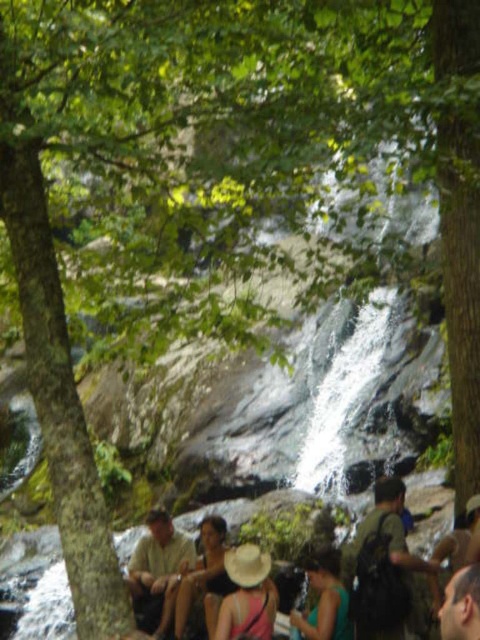
Question: Estimate the real-world distances between objects in this image. Which object is closer to the green fabric backpack at center?

Choices:
 (A) white frothy water at center
 (B) beige straw hat at center

Answer: (B)

Question: Estimate the real-world distances between objects in this image. Which object is farther from the green fabric backpack at center?

Choices:
 (A) light brown fabric shirt at lower left
 (B) white frothy water at center

Answer: (B)

Question: Which object is farther from the camera taking this photo?

Choices:
 (A) white frothy water at center
 (B) pink fabric at lower center
 (C) green matte dress at center

Answer: (B)

Question: Does white frothy water at center appear under green fabric backpack at center?

Choices:
 (A) no
 (B) yes

Answer: (A)

Question: Can you confirm if green fabric backpack at center is positioned above green matte dress at center?

Choices:
 (A) yes
 (B) no

Answer: (A)

Question: Does green fabric backpack at center lie in front of light brown fabric shirt at lower left?

Choices:
 (A) yes
 (B) no

Answer: (A)